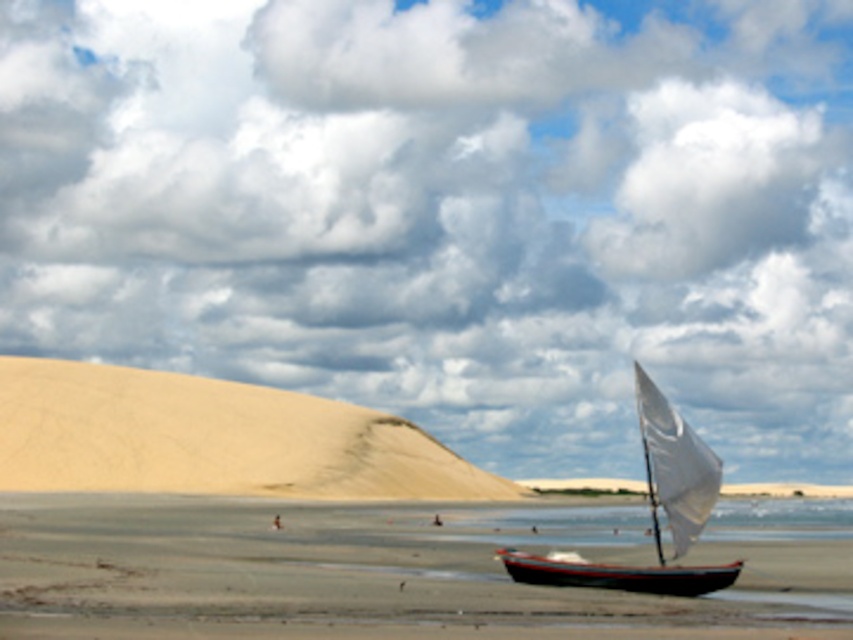
Does point (653, 8) come closer to viewer compared to point (659, 577)?

No, (653, 8) is behind (659, 577).

Between cloudy sky at upper center and wooden sailboat at lower right, which one has more height?

cloudy sky at upper center

Between point (318, 109) and point (622, 579), which one is positioned in front?

Point (622, 579)

Locate an element on the screen. This screenshot has height=640, width=853. cloudy sky at upper center is located at coordinates (450, 212).

Is smooth sand beach at lower center bigger than wooden sailboat at lower right?

Yes.

Can you confirm if smooth sand beach at lower center is positioned to the left of wooden sailboat at lower right?

Correct, you'll find smooth sand beach at lower center to the left of wooden sailboat at lower right.

Measure the distance between smooth sand beach at lower center and camera.

smooth sand beach at lower center is 12.61 meters away from camera.

Find the location of a particular element. smooth sand beach at lower center is located at coordinates (397, 570).

What are the coordinates of `cloudy sky at upper center` in the screenshot? It's located at (450, 212).

Who is lower down, cloudy sky at upper center or white canvas sailboat at right?

white canvas sailboat at right is below.

Which is in front, point (427, 365) or point (683, 483)?

Positioned in front is point (683, 483).

Where is `cloudy sky at upper center`? cloudy sky at upper center is located at coordinates (450, 212).